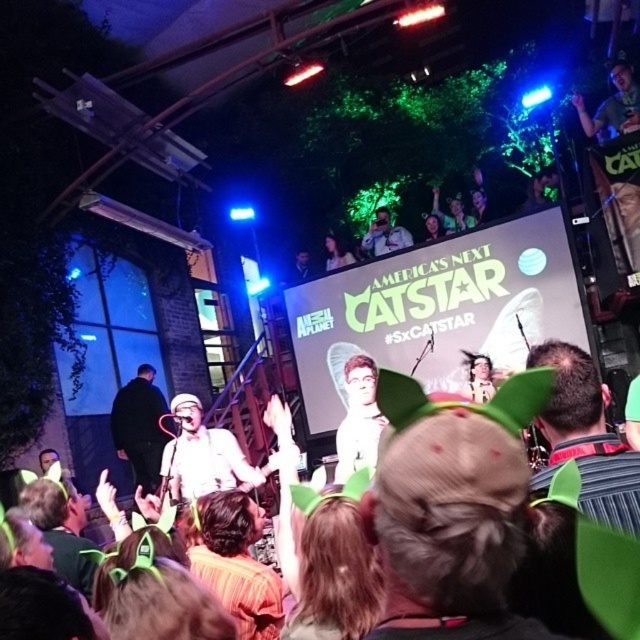
Can you confirm if dark brown hair at center is taller than striped shirt at lower center?

No, dark brown hair at center is not taller than striped shirt at lower center.

From the picture: Who is more forward, [586,472] or [220,557]?

Point [586,472] is more forward.

Does point (604, 392) come in front of point (188, 557)?

Yes.

I want to click on dark brown hair at center, so click(586, 436).

Between dark brown hair at center and dark gray fabric jacket at center, which one is positioned lower?

dark gray fabric jacket at center

Is dark brown hair at center wider than dark gray fabric jacket at center?

No, dark brown hair at center is not wider than dark gray fabric jacket at center.

Describe the element at coordinates (586, 436) in the screenshot. I see `dark brown hair at center` at that location.

At what (x,y) coordinates should I click in order to perform the action: click on dark brown hair at center. Please return your answer as a coordinate pair (x, y). Looking at the image, I should click on tap(586, 436).

Who is higher up, striped shirt at lower center or smooth white shirt at center?

smooth white shirt at center is higher up.

Is striped shirt at lower center positioned at the back of smooth white shirt at center?

No, striped shirt at lower center is closer to the viewer.

Does point (275, 605) lie in front of point (348, 474)?

Yes.

Locate an element on the screen. Image resolution: width=640 pixels, height=640 pixels. striped shirt at lower center is located at coordinates (237, 564).